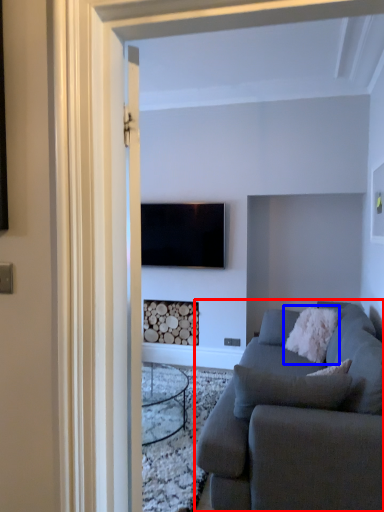
Question: Which of the following is the closest to the observer, studio couch (highlighted by a red box) or pillow (highlighted by a blue box)?

Choices:
 (A) studio couch
 (B) pillow

Answer: (A)